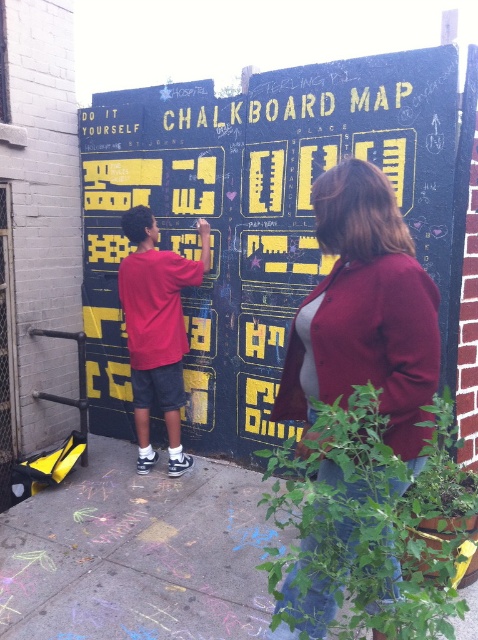
Question: Which is nearer to the concrete sidewalk at lower center?

Choices:
 (A) black chalkboard map at center
 (B) maroon sweater at center

Answer: (A)

Question: Considering the real-world distances, which object is farthest from the matte red shirt at left?

Choices:
 (A) maroon sweater at center
 (B) concrete sidewalk at lower center

Answer: (A)

Question: Among these objects, which one is farthest from the camera?

Choices:
 (A) concrete sidewalk at lower center
 (B) black chalkboard map at center
 (C) maroon sweater at center

Answer: (B)

Question: Does maroon sweater at center have a smaller size compared to matte red shirt at left?

Choices:
 (A) yes
 (B) no

Answer: (B)

Question: Is black chalkboard map at center wider than matte red shirt at left?

Choices:
 (A) yes
 (B) no

Answer: (A)

Question: Does maroon sweater at center appear over matte red shirt at left?

Choices:
 (A) yes
 (B) no

Answer: (B)